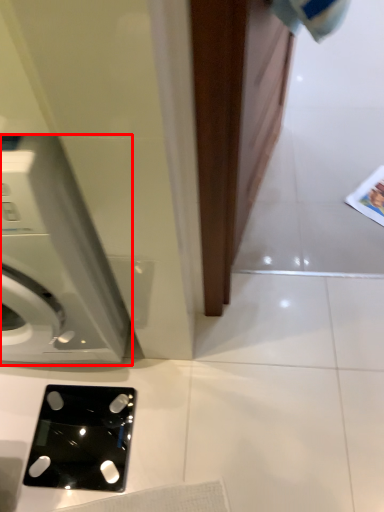
Question: From the image's perspective, where is washing machine (annotated by the red box) located in relation to ipod in the image?

Choices:
 (A) below
 (B) above

Answer: (B)